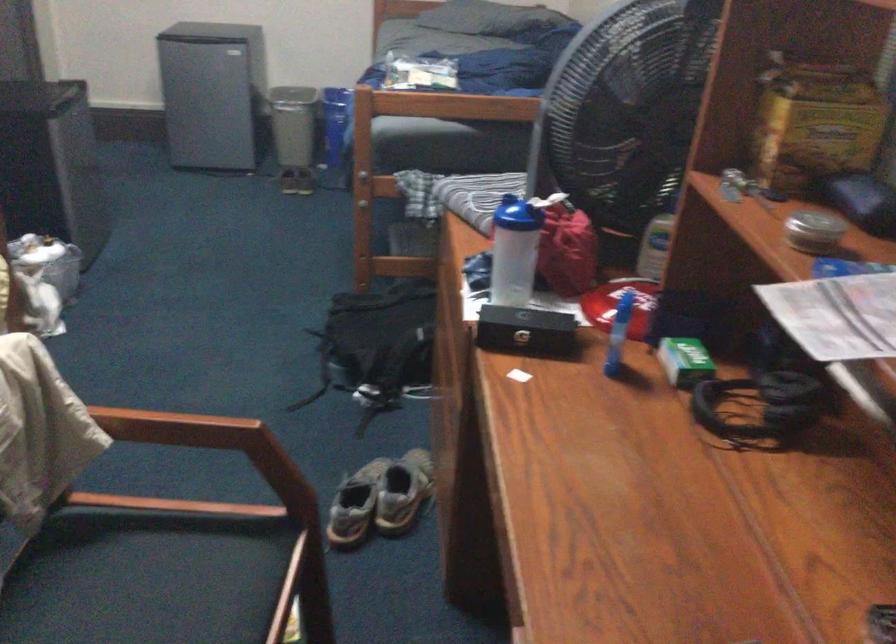
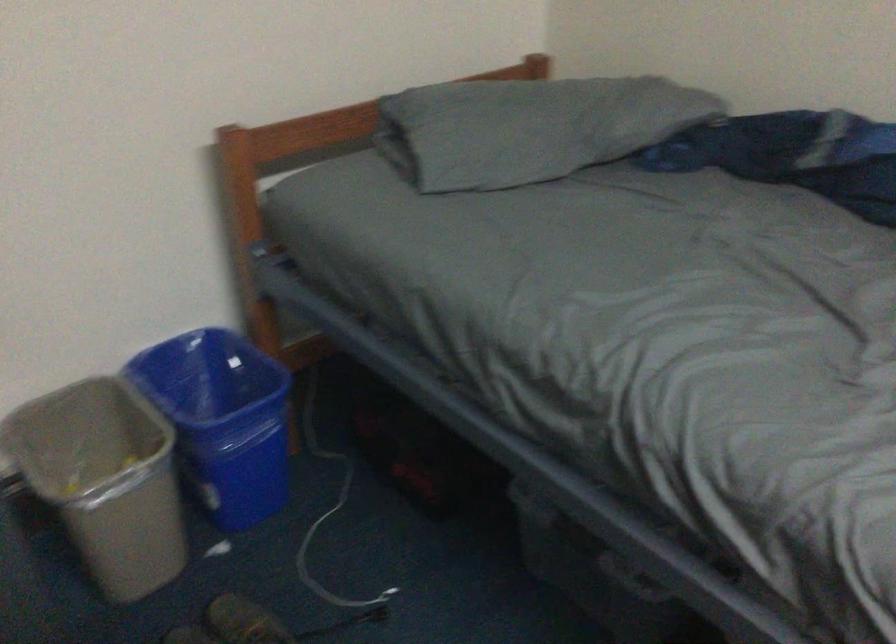
In the second image, find the point that corresponds to point 314,70 in the first image.

(221, 420)